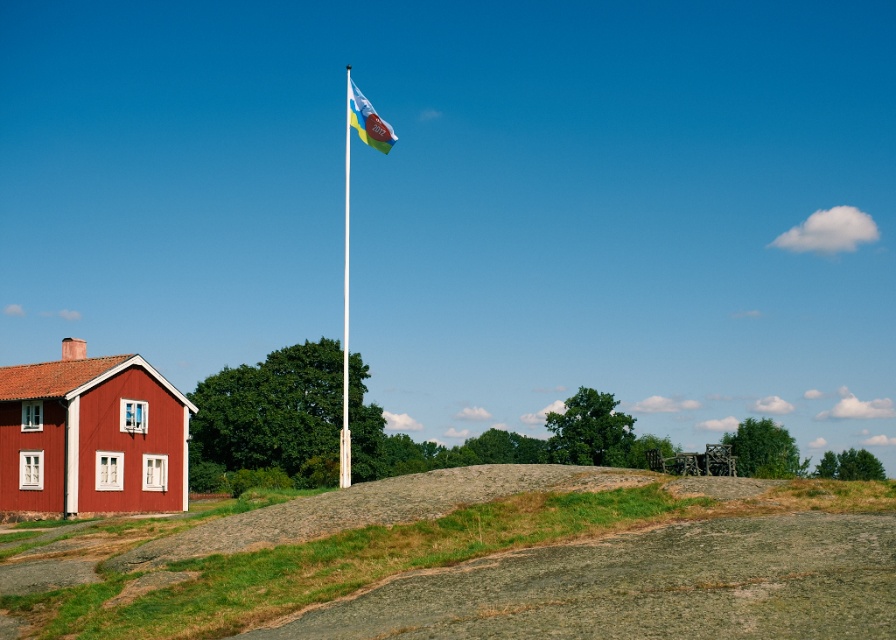
Who is lower down, white glossy flag pole at center or polyester flag at upper center?

Positioned lower is white glossy flag pole at center.

Is point (343, 275) closer to camera compared to point (376, 118)?

No, it is not.

The width and height of the screenshot is (896, 640). Describe the element at coordinates (345, 305) in the screenshot. I see `white glossy flag pole at center` at that location.

Locate an element on the screen. The width and height of the screenshot is (896, 640). white glossy flag pole at center is located at coordinates (345, 305).